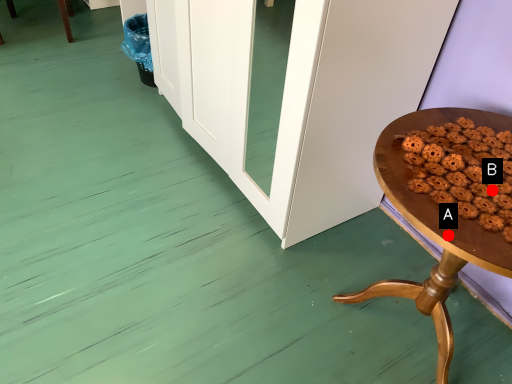
Question: Two points are circled on the image, labeled by A and B beside each circle. Which point is closer to the camera?

Choices:
 (A) A is closer
 (B) B is closer

Answer: (A)